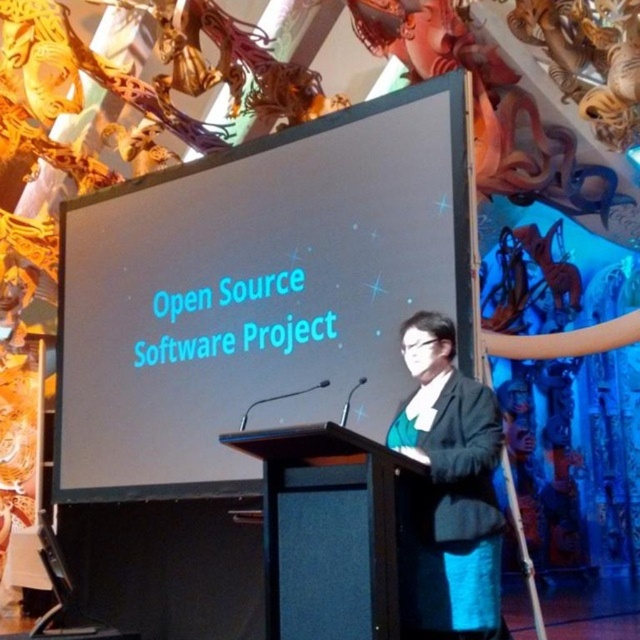
You are an attendee at a presentation. You want to approach the podium to ask a question. Which object, the black glossy projection screen at center or the black matte podium at center, will you pass by first as you move towards the podium?

You will pass by the black glossy projection screen at center first because it is closer to you than the black matte podium at center.

You are an attendee at this presentation. You see the black matte podium at center and the dark gray suit at center. Which object is positioned to the left from your perspective?

The black matte podium at center is to the left of the dark gray suit at center from your perspective.

You are an event organizer who needs to ensure that the black matte podium at center and the dark gray suit at center are visible to the audience. Considering their sizes, which one might be more challenging to see from the back of the room?

The black matte podium at center has a smaller size compared to the dark gray suit at center, so the podium might be harder to see from the back of the room because it is smaller.